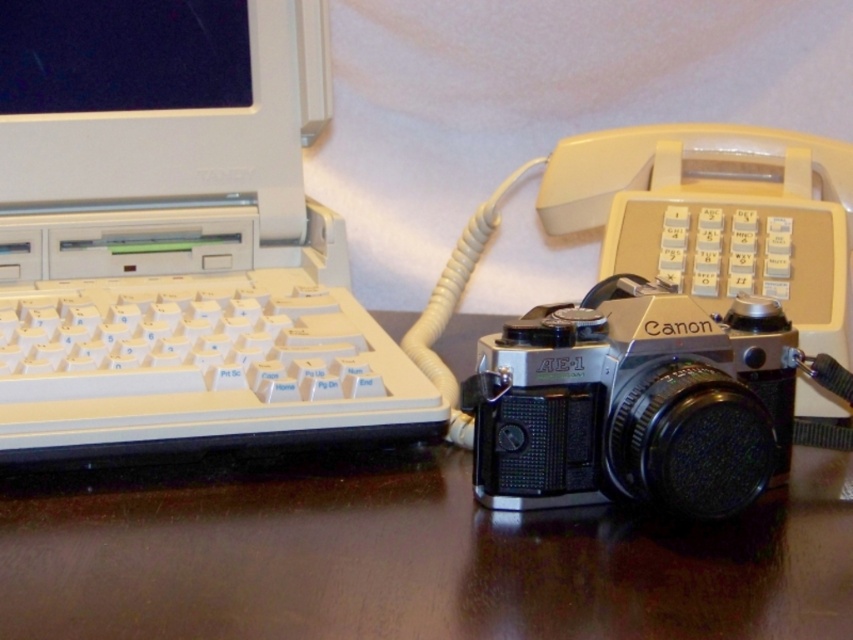
Measure the distance between dark brown wood table at center and white plastic keyboard at left.

dark brown wood table at center is 3.92 inches away from white plastic keyboard at left.

Who is positioned more to the right, dark brown wood table at center or white plastic keyboard at left?

From the viewer's perspective, dark brown wood table at center appears more on the right side.

Locate an element on the screen. The image size is (853, 640). dark brown wood table at center is located at coordinates (407, 556).

From the picture: Who is higher up, dark brown wood table at center or silver metallic camera at center?

Positioned higher is silver metallic camera at center.

Does dark brown wood table at center have a greater height compared to silver metallic camera at center?

In fact, dark brown wood table at center may be shorter than silver metallic camera at center.

This screenshot has height=640, width=853. I want to click on dark brown wood table at center, so click(407, 556).

Is white plastic laptop at left wider than silver metallic camera at center?

Indeed, white plastic laptop at left has a greater width compared to silver metallic camera at center.

Between white plastic laptop at left and silver metallic camera at center, which one has more height?

With more height is white plastic laptop at left.

Is point (225, 86) positioned after point (476, 394)?

Yes, point (225, 86) is behind point (476, 394).

Identify the location of white plastic laptop at left. Image resolution: width=853 pixels, height=640 pixels. (177, 241).